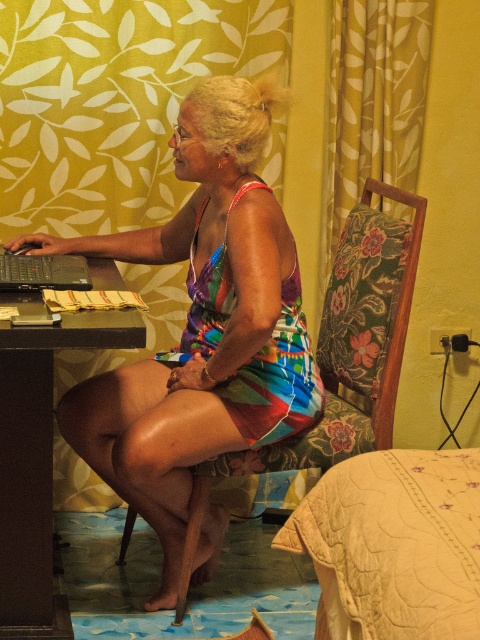
Question: Does beige quilted bed at lower right have a lesser width compared to multicolored printed dress at center?

Choices:
 (A) no
 (B) yes

Answer: (B)

Question: Is black plastic table at left closer to camera compared to multicolored printed dress at center?

Choices:
 (A) no
 (B) yes

Answer: (B)

Question: Estimate the real-world distances between objects in this image. Which object is closer to the floral fabric chair at center?

Choices:
 (A) beige quilted bed at lower right
 (B) black plastic table at left
 (C) multicolored printed dress at center

Answer: (C)

Question: Among these points, which one is farthest from the camera?

Choices:
 (A) (273, 365)
 (B) (387, 467)
 (C) (154, 232)
 (D) (41, 256)

Answer: (C)

Question: Is multicolored fabric dress at center to the left of multicolored printed dress at center from the viewer's perspective?

Choices:
 (A) yes
 (B) no

Answer: (A)

Question: Which point is farther to the camera?

Choices:
 (A) (337, 512)
 (B) (195, 300)

Answer: (B)